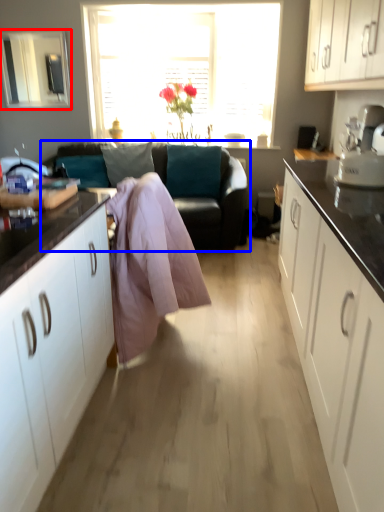
Question: Which object is further to the camera taking this photo, window screen (highlighted by a red box) or studio couch (highlighted by a blue box)?

Choices:
 (A) window screen
 (B) studio couch

Answer: (A)